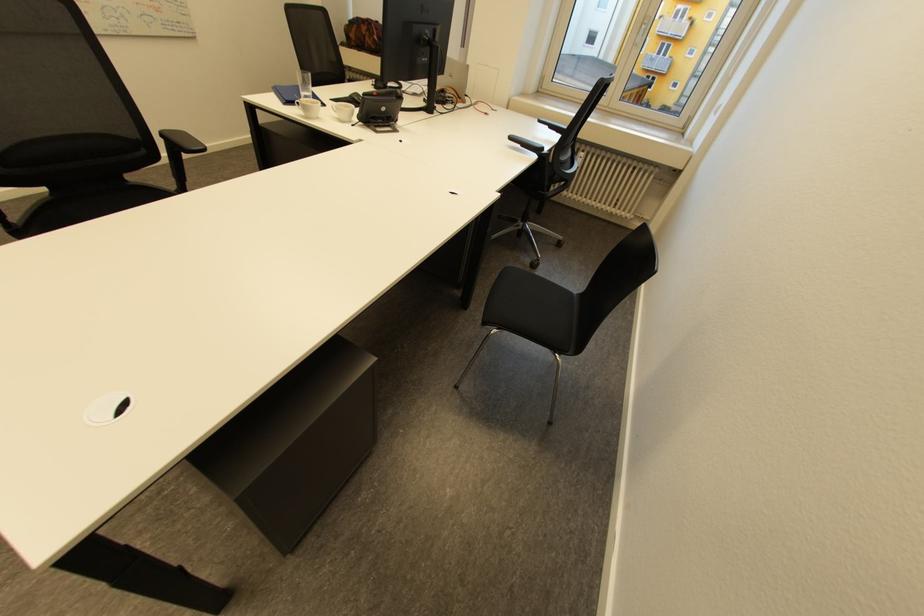
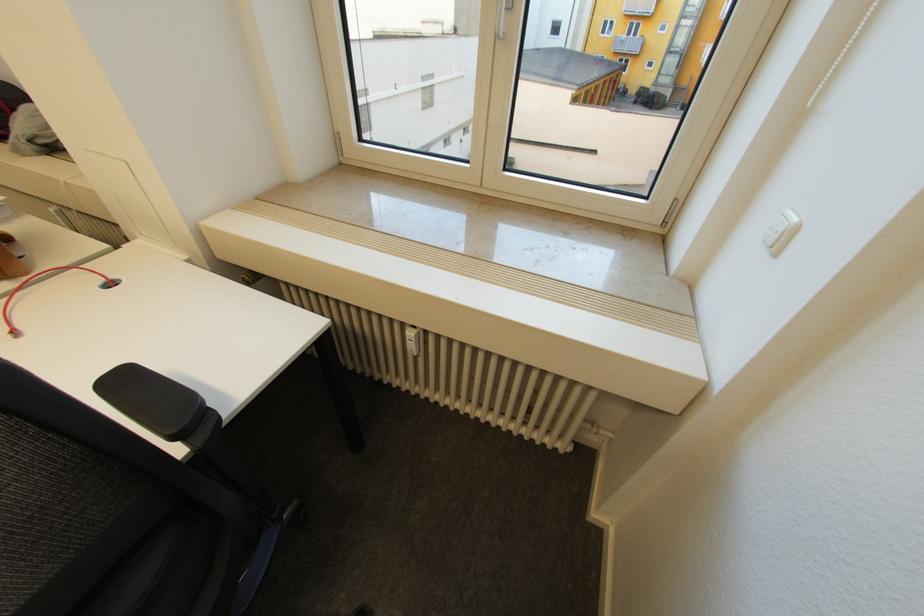
Which direction would the cameraman need to move to produce the second image?

The cameraman walked toward right, forward.